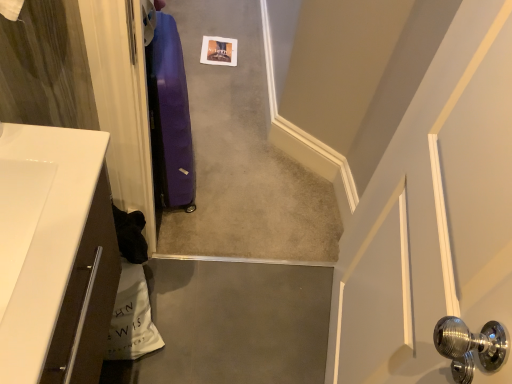
Locate an element on the screen. purple fabric suitcase at left is located at coordinates (170, 117).

Where is `concrete that appears on the right of purple fabric suitcase at left`? This screenshot has width=512, height=384. concrete that appears on the right of purple fabric suitcase at left is located at coordinates (242, 155).

Considering the sizes of objects purple fabric suitcase at center and purple fabric suitcase at left in the image provided, who is thinner, purple fabric suitcase at center or purple fabric suitcase at left?

purple fabric suitcase at left.

Could you tell me if purple fabric suitcase at center is facing purple fabric suitcase at left?

No, purple fabric suitcase at center is not aimed at purple fabric suitcase at left.

Between point (284, 154) and point (170, 102), which one is positioned in front?

The point (170, 102) is more forward.

Relative to purple fabric suitcase at center, is purple fabric suitcase at left in front or behind?

purple fabric suitcase at left is in front of purple fabric suitcase at center.

Is purple fabric suitcase at left at the right side of purple fabric suitcase at center?

No, purple fabric suitcase at left is not to the right of purple fabric suitcase at center.

In terms of height, does purple fabric suitcase at left look taller or shorter compared to purple fabric suitcase at center?

Considering their sizes, purple fabric suitcase at left has more height than purple fabric suitcase at center.

Considering the sizes of objects purple fabric suitcase at left and purple fabric suitcase at center in the image provided, who is thinner, purple fabric suitcase at left or purple fabric suitcase at center?

purple fabric suitcase at left.

Is point (45, 276) less distant than point (179, 117)?

Yes, point (45, 276) is in front of point (179, 117).

Does white glossy countertop at lower left have a greater height compared to purple fabric suitcase at left?

No.

Which object is further away from the camera taking this photo, white glossy countertop at lower left or purple fabric suitcase at left?

purple fabric suitcase at left is further away from the camera.

From the image's perspective, is white glossy countertop at lower left on purple fabric suitcase at left?

No, from the image's perspective, white glossy countertop at lower left is not above purple fabric suitcase at left.

Is purple fabric suitcase at left positioned behind white glossy countertop at lower left?

Yes, purple fabric suitcase at left is further from the viewer.

Is purple fabric suitcase at left aimed at white glossy countertop at lower left?

No, purple fabric suitcase at left is not aimed at white glossy countertop at lower left.

Considering the relative sizes of purple fabric suitcase at left and white glossy countertop at lower left in the image provided, is purple fabric suitcase at left taller than white glossy countertop at lower left?

Yes, purple fabric suitcase at left is taller than white glossy countertop at lower left.

From a real-world perspective, between purple fabric suitcase at left and white glossy countertop at lower left, who is vertically lower?

From a 3D spatial view, purple fabric suitcase at left is below.

Is white glossy countertop at lower left positioned with its back to purple fabric suitcase at center?

That's not correct — white glossy countertop at lower left is not looking away from purple fabric suitcase at center.

Which of these two, white glossy countertop at lower left or purple fabric suitcase at center, stands taller?

white glossy countertop at lower left is taller.

Is white glossy countertop at lower left directly adjacent to purple fabric suitcase at center?

white glossy countertop at lower left is not next to purple fabric suitcase at center, and they're not touching.

Is the position of purple fabric suitcase at center less distant than that of white glossy countertop at lower left?

That is False.

Between point (315, 185) and point (51, 375), which one is positioned in front?

The point (51, 375) is closer.

In terms of height, does purple fabric suitcase at center look taller or shorter compared to white glossy countertop at lower left?

In the image, purple fabric suitcase at center appears to be shorter than white glossy countertop at lower left.

This screenshot has height=384, width=512. Find the location of `concrete beneath the purple fabric suitcase at left (from a real-world perspective)`. concrete beneath the purple fabric suitcase at left (from a real-world perspective) is located at coordinates (242, 155).

Locate an element on the screen. Image resolution: width=512 pixels, height=384 pixels. luggage in front of the purple fabric suitcase at center is located at coordinates (170, 117).

When comparing their distances from white glossy countertop at lower left, does purple fabric suitcase at center or purple fabric suitcase at left seem closer?

The object closer to white glossy countertop at lower left is purple fabric suitcase at left.

From the picture: Which object lies further to the anchor point purple fabric suitcase at left, purple fabric suitcase at center or white glossy countertop at lower left?

Based on the image, white glossy countertop at lower left appears to be further to purple fabric suitcase at left.

Looking at the image, which one is located closer to white glossy countertop at lower left, purple fabric suitcase at left or purple fabric suitcase at center?

purple fabric suitcase at left.

Considering their positions, is purple fabric suitcase at left positioned closer to purple fabric suitcase at center than white glossy countertop at lower left?

purple fabric suitcase at left is closer to purple fabric suitcase at center.

Looking at the image, which one is located closer to purple fabric suitcase at left, white glossy countertop at lower left or purple fabric suitcase at center?

Among the two, purple fabric suitcase at center is located nearer to purple fabric suitcase at left.

When comparing their distances from purple fabric suitcase at center, does white glossy countertop at lower left or purple fabric suitcase at left seem closer?

purple fabric suitcase at left is closer to purple fabric suitcase at center.

Where is `luggage between white glossy countertop at lower left and purple fabric suitcase at center from front to back`? This screenshot has width=512, height=384. luggage between white glossy countertop at lower left and purple fabric suitcase at center from front to back is located at coordinates (170, 117).